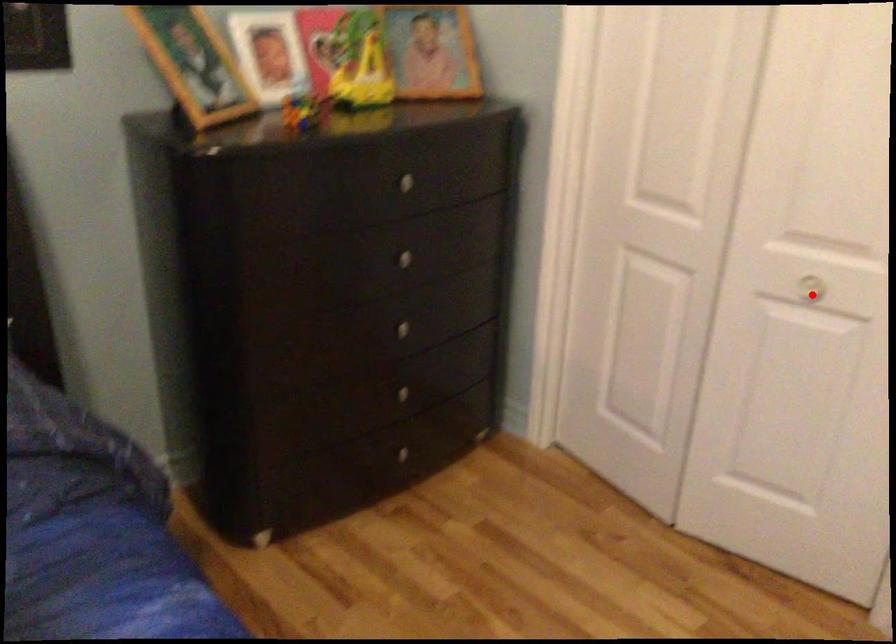
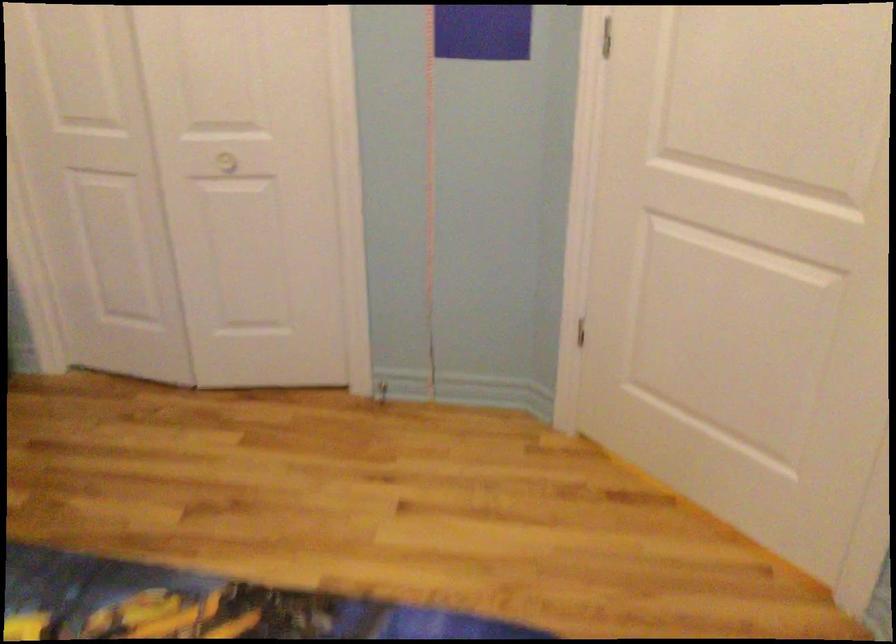
Question: I am providing you with two images of the same scene from different viewpoints. A red point is shown in image1. For the corresponding object point in image2, is it positioned nearer or farther from the camera?

Choices:
 (A) Nearer
 (B) Farther

Answer: (B)